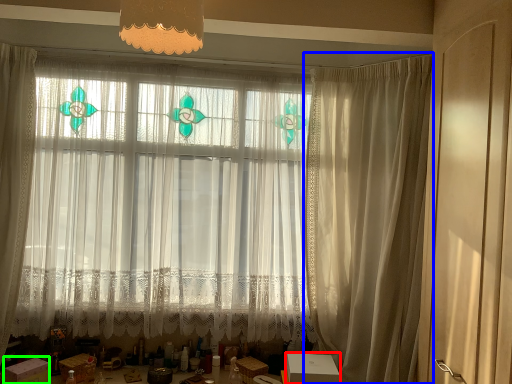
Question: Estimate the real-world distances between objects in this image. Which object is closer to cardboard box (highlighted by a red box), curtain (highlighted by a blue box) or cardboard box (highlighted by a green box)?

Choices:
 (A) curtain
 (B) cardboard box

Answer: (A)